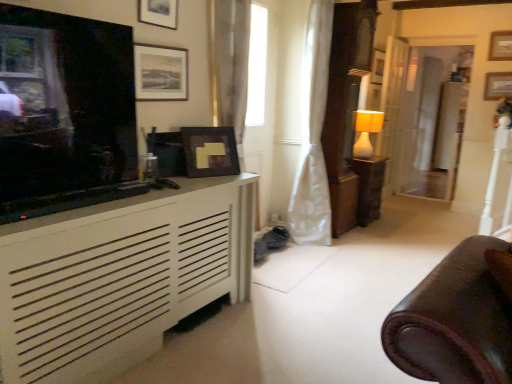
Question: Is wooden picture frame at upper right, which is the third picture frame in back-to-front order, inside the boundaries of matte black picture frame at upper center, the 6th picture frame when ordered from right to left, or outside?

Choices:
 (A) inside
 (B) outside

Answer: (B)

Question: Considering the positions of wooden picture frame at upper right, the sixth picture frame viewed from the left, and matte black picture frame at upper center, arranged as the fifth picture frame when viewed from the back, in the image, is wooden picture frame at upper right, the sixth picture frame viewed from the left, bigger or smaller than matte black picture frame at upper center, arranged as the fifth picture frame when viewed from the back,?

Choices:
 (A) big
 (B) small

Answer: (A)

Question: Which is farther from the matte black picture frame at upper center, the 2th picture frame in the front-to-back sequence?

Choices:
 (A) white satin curtain at center
 (B) matte black television at left
 (C) matte brown wooden table at center-right
 (D) wooden picture frame at upper center, marked as the third picture frame in a right-to-left arrangement
 (E) wooden picture frame at upper right, the fifth picture frame viewed from the front

Answer: (E)

Question: Which object is positioned closest to the wooden picture frame at upper center, which is counted as the fourth picture frame, starting from the left?

Choices:
 (A) white wood door at center right
 (B) white satin curtain at center
 (C) matte black television at left
 (D) matte black picture frame at upper center, which is counted as the third picture frame, starting from the left
 (E) matte brown wooden table at center-right

Answer: (A)